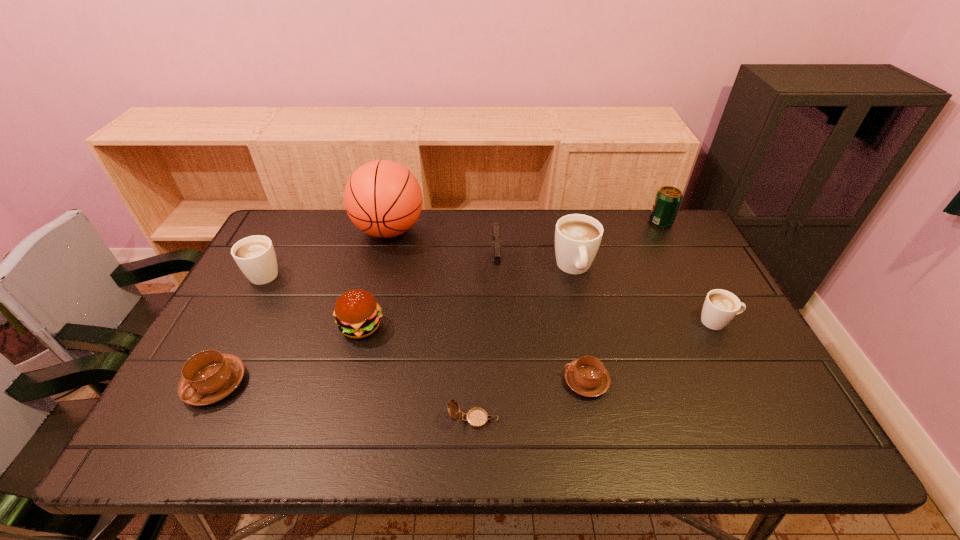
Where is `orange basketball`? orange basketball is located at coordinates (382, 198).

Locate an element on the screen. the tallest object is located at coordinates tap(382, 198).

Where is `the second white cappuccino from right to left`? This screenshot has height=540, width=960. the second white cappuccino from right to left is located at coordinates (577, 237).

This screenshot has width=960, height=540. I want to click on the tallest cappuccino, so click(577, 237).

This screenshot has width=960, height=540. I want to click on beer can, so click(x=668, y=199).

The height and width of the screenshot is (540, 960). I want to click on pistol, so click(496, 240).

At what (x,y) coordinates should I click in order to perform the action: click on the second tallest cappuccino. Please return your answer as a coordinate pair (x, y). The image size is (960, 540). Looking at the image, I should click on (255, 255).

Locate an element on the screen. This screenshot has height=540, width=960. the second biggest white cappuccino is located at coordinates (255, 255).

The width and height of the screenshot is (960, 540). In order to click on hamburger in this screenshot , I will do `click(357, 313)`.

Where is `the rightmost white cappuccino`? the rightmost white cappuccino is located at coordinates (720, 306).